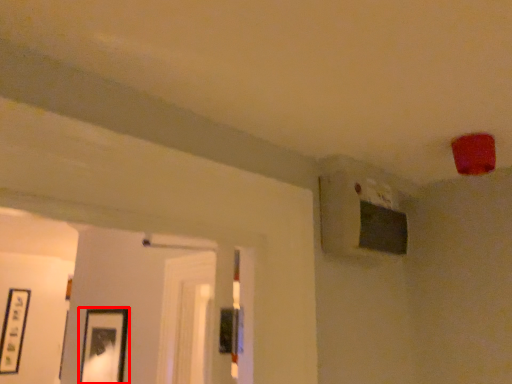
Question: In this image, where is picture frame (annotated by the red box) located relative to picture frame?

Choices:
 (A) left
 (B) right

Answer: (B)